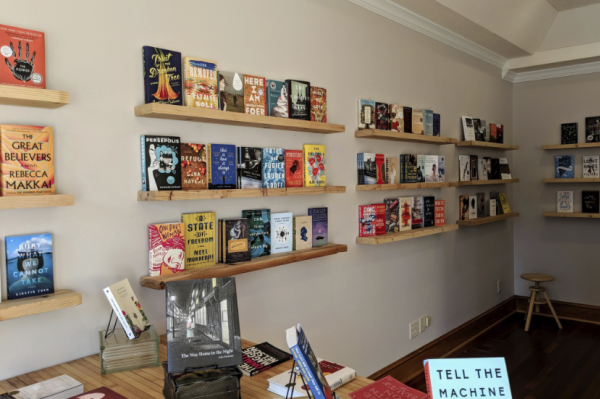
Where is `books on the desk`? books on the desk is located at coordinates (59, 381), (108, 392), (126, 317), (200, 337), (267, 357), (337, 373), (313, 367), (383, 389), (486, 384).